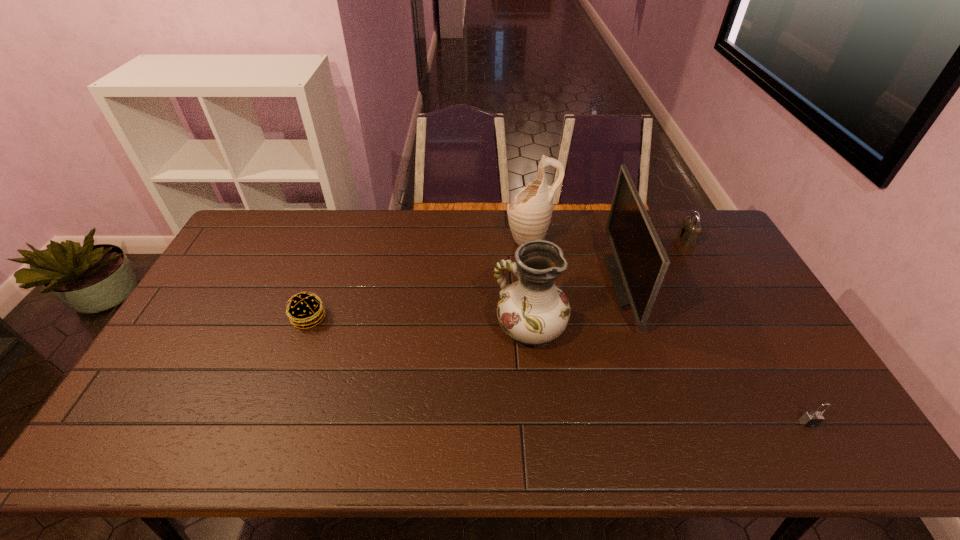
At what (x,y) coordinates should I click in order to perform the action: click on vacant space that satisfies the following two spatial constraints: 1. at the front of the fourth tallest object near the keyhole; 2. on the front side of the leftmost object. Please return your answer as a coordinate pair (x, y). This screenshot has width=960, height=540. Looking at the image, I should click on (729, 318).